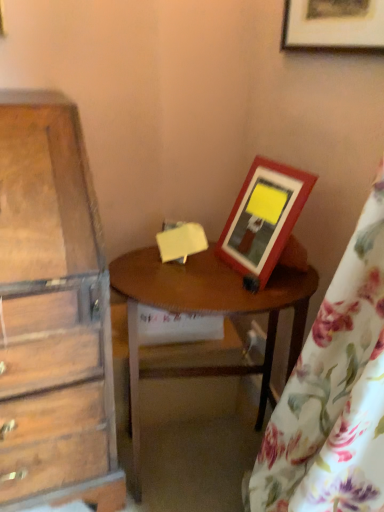
At what (x,y) coordinates should I click in order to perform the action: click on floral fabric curtain at right. Please return your answer as a coordinate pair (x, y). Image resolution: width=384 pixels, height=512 pixels. Looking at the image, I should click on (333, 393).

In the image, is wooden picture frame at upper right, acting as the second picture frame starting from the top, positioned in front of or behind wooden picture frame at upper right, the second picture frame positioned from the bottom?

In the image, wooden picture frame at upper right, acting as the second picture frame starting from the top, appears behind wooden picture frame at upper right, the second picture frame positioned from the bottom.

How many degrees apart are the facing directions of wooden picture frame at upper right, acting as the second picture frame starting from the top, and wooden picture frame at upper right, the first picture frame positioned from the top?

wooden picture frame at upper right, acting as the second picture frame starting from the top, and wooden picture frame at upper right, the first picture frame positioned from the top, are facing 4.84 degrees away from each other.

Which point is more distant from viewer, (268, 178) or (290, 32)?

Positioned behind is point (290, 32).

How many degrees apart are the facing directions of floral fabric curtain at right and wooden table at center?

The facing directions of floral fabric curtain at right and wooden table at center are 77.2 degrees apart.

Can you confirm if floral fabric curtain at right is positioned to the left of wooden table at center?

No, floral fabric curtain at right is not to the left of wooden table at center.

Considering the relative sizes of floral fabric curtain at right and wooden table at center in the image provided, is floral fabric curtain at right shorter than wooden table at center?

Incorrect, the height of floral fabric curtain at right does not fall short of that of wooden table at center.

Which is behind, point (339, 1) or point (263, 288)?

The point (263, 288) is farther.

How different are the orientations of wooden picture frame at upper right, the first picture frame positioned from the top, and wooden picture frame at upper right, acting as the second picture frame starting from the top, in degrees?

The angular difference between wooden picture frame at upper right, the first picture frame positioned from the top, and wooden picture frame at upper right, acting as the second picture frame starting from the top, is 4.84 degrees.

At what (x,y) coordinates should I click in order to perform the action: click on picture frame that appears below the wooden picture frame at upper right, the second picture frame positioned from the bottom (from the image's perspective). Please return your answer as a coordinate pair (x, y). Image resolution: width=384 pixels, height=512 pixels. Looking at the image, I should click on pos(263,217).

Could you tell me if wooden picture frame at upper right, the second picture frame positioned from the bottom, is turned towards wooden picture frame at upper right, acting as the second picture frame starting from the top?

No, wooden picture frame at upper right, the second picture frame positioned from the bottom, is not facing towards wooden picture frame at upper right, acting as the second picture frame starting from the top.

From the image's perspective, is wooden picture frame at upper right, acting as the second picture frame starting from the top, located above wooden table at center?

Answer: Yes, from the image's perspective, wooden picture frame at upper right, acting as the second picture frame starting from the top, is on top of wooden table at center.

Does wooden picture frame at upper right, marked as the 1th picture frame in a bottom-to-top arrangement, turn towards wooden table at center?

No, wooden picture frame at upper right, marked as the 1th picture frame in a bottom-to-top arrangement, does not turn towards wooden table at center.

From the picture: Does wooden picture frame at upper right, marked as the 1th picture frame in a bottom-to-top arrangement, have a greater width compared to wooden table at center?

Incorrect, the width of wooden picture frame at upper right, marked as the 1th picture frame in a bottom-to-top arrangement, does not surpass that of wooden table at center.

Which is closer to the camera, (237, 236) or (193, 291)?

The point (193, 291) is more forward.

Can you see floral fabric curtain at right touching wooden picture frame at upper right, acting as the second picture frame starting from the top?

No, floral fabric curtain at right is not next to wooden picture frame at upper right, acting as the second picture frame starting from the top.

Looking at this image, from the image's perspective, is floral fabric curtain at right beneath wooden picture frame at upper right, marked as the 1th picture frame in a bottom-to-top arrangement?

Yes, from the image's perspective, floral fabric curtain at right is beneath wooden picture frame at upper right, marked as the 1th picture frame in a bottom-to-top arrangement.

In the image, is floral fabric curtain at right positioned in front of or behind wooden picture frame at upper right, acting as the second picture frame starting from the top?

Answer: In the image, floral fabric curtain at right appears in front of wooden picture frame at upper right, acting as the second picture frame starting from the top.

Based on the photo, considering the sizes of objects wooden table at center and wooden picture frame at upper right, the second picture frame positioned from the bottom, in the image provided, who is thinner, wooden table at center or wooden picture frame at upper right, the second picture frame positioned from the bottom,?

wooden picture frame at upper right, the second picture frame positioned from the bottom, is thinner.

Considering the points (306, 286) and (361, 17), which point is behind, point (306, 286) or point (361, 17)?

Positioned behind is point (306, 286).

Where is `picture frame that is the 2nd object located above the wooden table at center (from the image's perspective)`? picture frame that is the 2nd object located above the wooden table at center (from the image's perspective) is located at coordinates (333, 24).

Which is correct: wooden table at center is inside wooden picture frame at upper right, the first picture frame positioned from the top, or outside of it?

The correct answer is: outside.

Can you confirm if wooden picture frame at upper right, marked as the 1th picture frame in a bottom-to-top arrangement, is wider than floral fabric curtain at right?

Incorrect, the width of wooden picture frame at upper right, marked as the 1th picture frame in a bottom-to-top arrangement, does not surpass that of floral fabric curtain at right.

From the image's perspective, is wooden picture frame at upper right, marked as the 1th picture frame in a bottom-to-top arrangement, located above floral fabric curtain at right?

Yes.

Which object is further away from the camera, wooden picture frame at upper right, acting as the second picture frame starting from the top, or floral fabric curtain at right?

wooden picture frame at upper right, acting as the second picture frame starting from the top, is further from the camera.

How distant is wooden picture frame at upper right, acting as the second picture frame starting from the top, from floral fabric curtain at right?

wooden picture frame at upper right, acting as the second picture frame starting from the top, and floral fabric curtain at right are 12.87 inches apart.

Image resolution: width=384 pixels, height=512 pixels. I want to click on picture frame behind the wooden picture frame at upper right, the second picture frame positioned from the bottom, so coord(263,217).

You are a GUI agent. You are given a task and a screenshot of the screen. Output one action in this format:
    pyautogui.click(x=<x>, y=<y>)
    Task: Click on the curtain in front of the wooden table at center
    
    Given the screenshot: What is the action you would take?
    pyautogui.click(x=333, y=393)

Considering their positions, is wooden picture frame at upper right, the second picture frame positioned from the bottom, positioned closer to floral fabric curtain at right than wooden table at center?

wooden table at center.

Estimate the real-world distances between objects in this image. Which object is closer to wooden picture frame at upper right, the second picture frame positioned from the bottom, floral fabric curtain at right or wooden table at center?

The object closer to wooden picture frame at upper right, the second picture frame positioned from the bottom, is floral fabric curtain at right.

From the image, which object appears to be farther from wooden table at center, wooden picture frame at upper right, acting as the second picture frame starting from the top, or floral fabric curtain at right?

floral fabric curtain at right.

Considering their positions, is wooden table at center positioned further to floral fabric curtain at right than wooden picture frame at upper right, the first picture frame positioned from the top?

wooden picture frame at upper right, the first picture frame positioned from the top, is further to floral fabric curtain at right.

Based on their spatial positions, is wooden table at center or wooden picture frame at upper right, acting as the second picture frame starting from the top, further from floral fabric curtain at right?

wooden picture frame at upper right, acting as the second picture frame starting from the top, is further to floral fabric curtain at right.

From the image, which object appears to be farther from wooden picture frame at upper right, acting as the second picture frame starting from the top, floral fabric curtain at right or wooden picture frame at upper right, the first picture frame positioned from the top?

The object further to wooden picture frame at upper right, acting as the second picture frame starting from the top, is wooden picture frame at upper right, the first picture frame positioned from the top.

Which object lies further to the anchor point wooden table at center, wooden picture frame at upper right, the first picture frame positioned from the top, or wooden picture frame at upper right, marked as the 1th picture frame in a bottom-to-top arrangement?

Based on the image, wooden picture frame at upper right, the first picture frame positioned from the top, appears to be further to wooden table at center.

From the image, which object appears to be nearer to wooden picture frame at upper right, marked as the 1th picture frame in a bottom-to-top arrangement, floral fabric curtain at right or wooden table at center?

The object closer to wooden picture frame at upper right, marked as the 1th picture frame in a bottom-to-top arrangement, is wooden table at center.

Identify the location of picture frame that lies between wooden picture frame at upper right, the second picture frame positioned from the bottom, and wooden table at center from top to bottom. (263, 217).

Image resolution: width=384 pixels, height=512 pixels. I want to click on curtain that lies between wooden picture frame at upper right, the first picture frame positioned from the top, and wooden table at center from top to bottom, so click(333, 393).

Identify the location of picture frame between wooden picture frame at upper right, the first picture frame positioned from the top, and floral fabric curtain at right in the up-down direction. (263, 217).